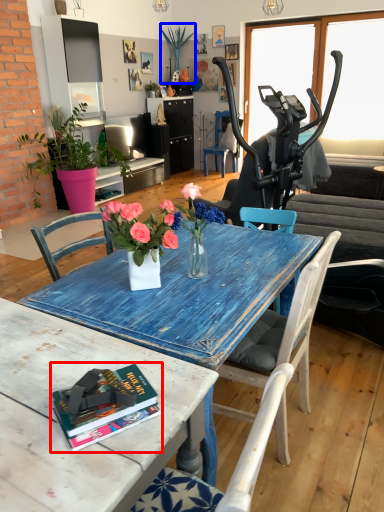
Question: Which object appears closest to the camera in this image, book (highlighted by a red box) or plant (highlighted by a blue box)?

Choices:
 (A) book
 (B) plant

Answer: (A)